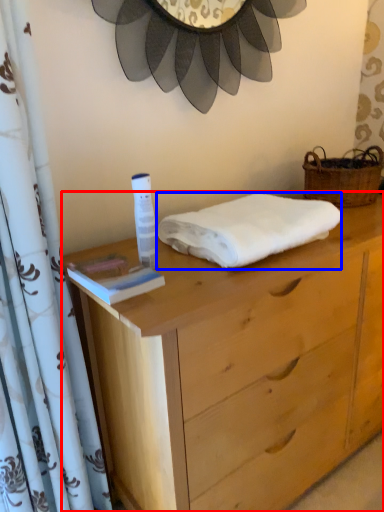
Question: Which point is closer to the camera, chest of drawers (highlighted by a red box) or towel (highlighted by a blue box)?

Choices:
 (A) chest of drawers
 (B) towel

Answer: (A)